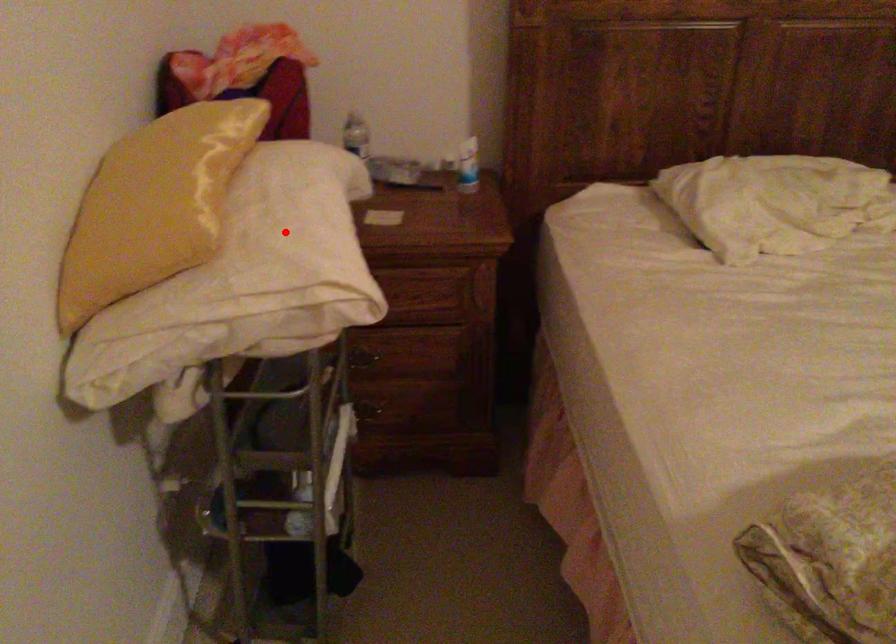
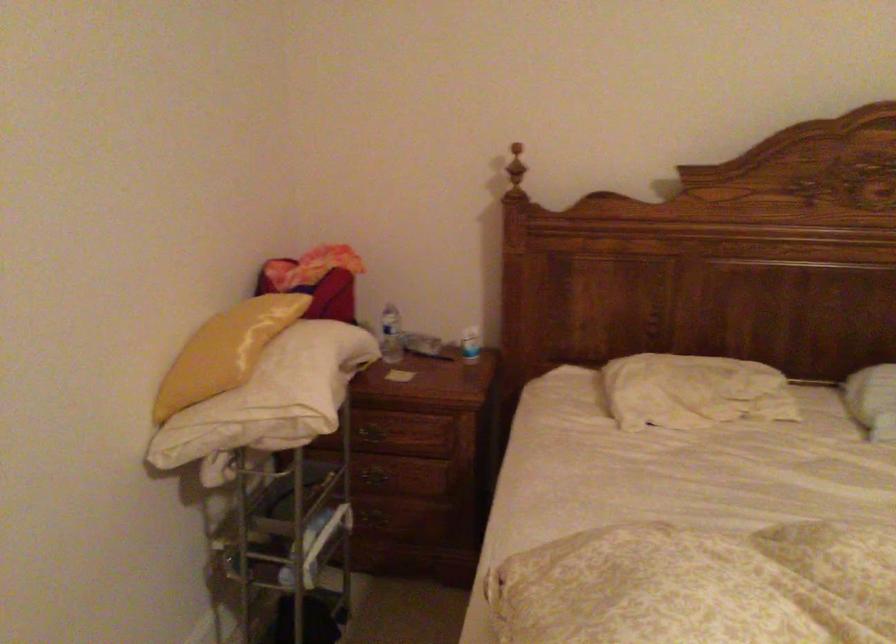
Question: I am providing you with two images of the same scene from different viewpoints. A red point is shown in image1. For the corresponding object point in image2, is it positioned nearer or farther from the camera?

Choices:
 (A) Nearer
 (B) Farther

Answer: (B)